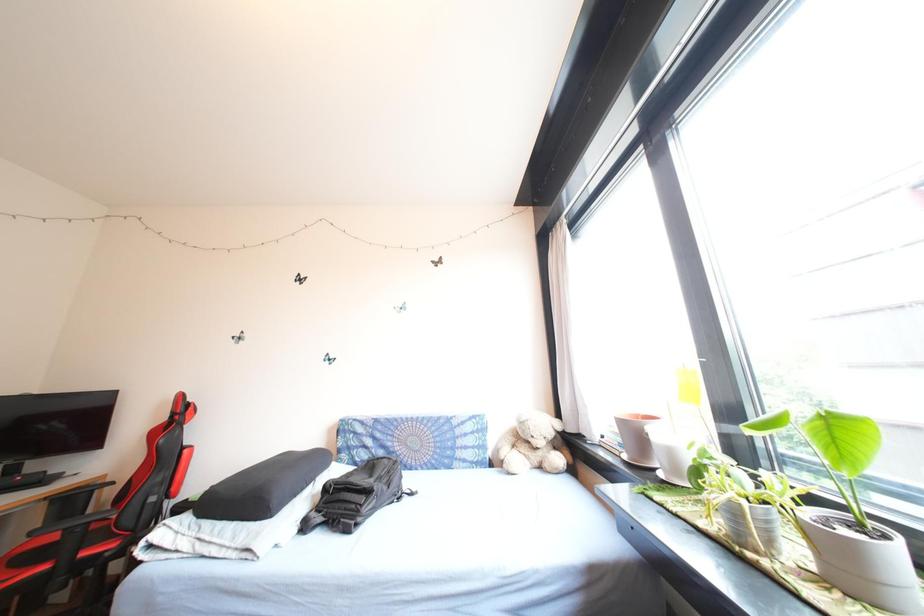
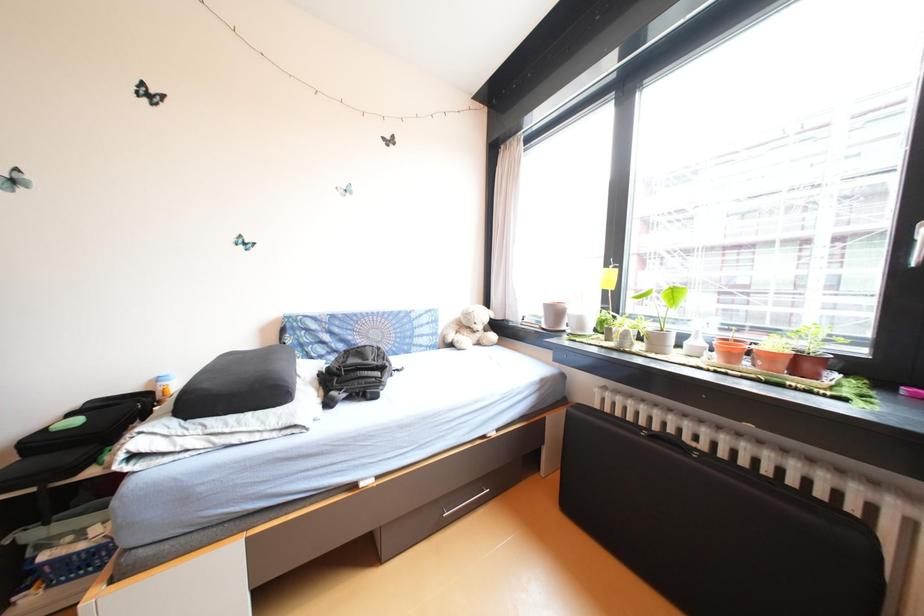
The images are taken continuously from a first-person perspective. In which direction is your viewpoint rotating?

The rotation direction of the camera is right-down.